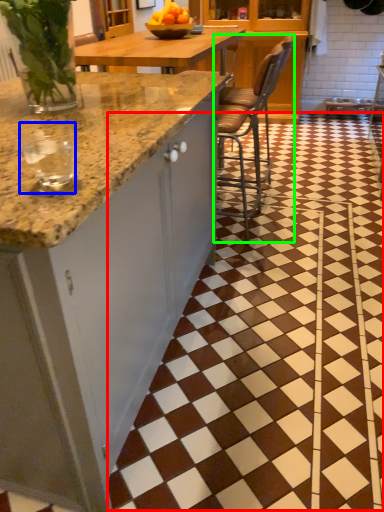
Question: Which object is the closest to the tile (highlighted by a red box)? Choose among these: wine glass (highlighted by a blue box) or chair (highlighted by a green box).

Choices:
 (A) wine glass
 (B) chair

Answer: (B)